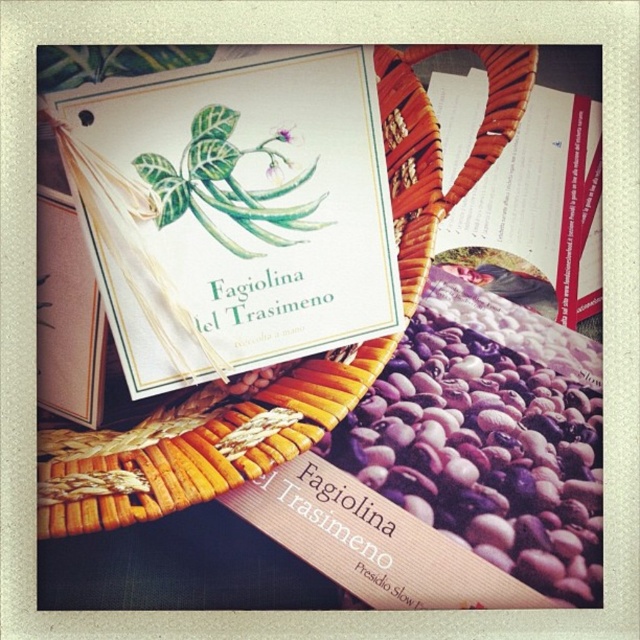
Is woven brown basket at center closer to camera compared to matte paper book at upper right?

Yes, it is.

Is woven brown basket at center to the right of matte paper book at upper right from the viewer's perspective?

In fact, woven brown basket at center is to the left of matte paper book at upper right.

Who is more distant from viewer, (x=268, y=396) or (x=536, y=241)?

Point (x=536, y=241)

You are a GUI agent. You are given a task and a screenshot of the screen. Output one action in this format:
    pyautogui.click(x=<x>, y=<y>)
    Task: Click on the woven brown basket at center
    This screenshot has height=640, width=640.
    Given the screenshot: What is the action you would take?
    pyautogui.click(x=196, y=442)